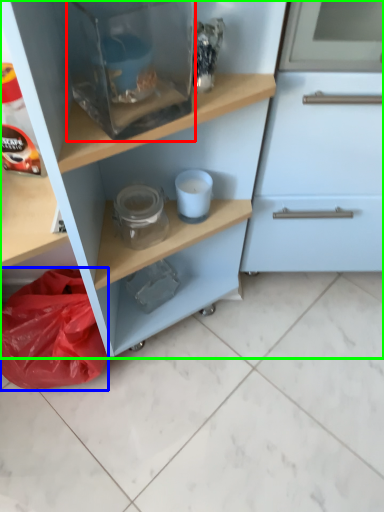
Question: Based on their relative distances, which object is farther from appliance (highlighted by a red box)? Choose from material (highlighted by a blue box) and cupboard (highlighted by a green box).

Choices:
 (A) material
 (B) cupboard

Answer: (A)